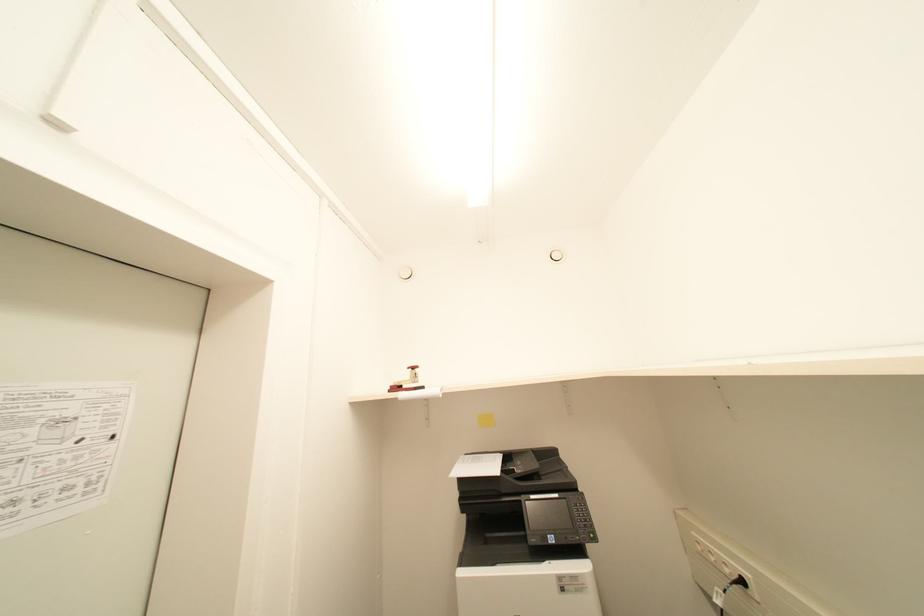
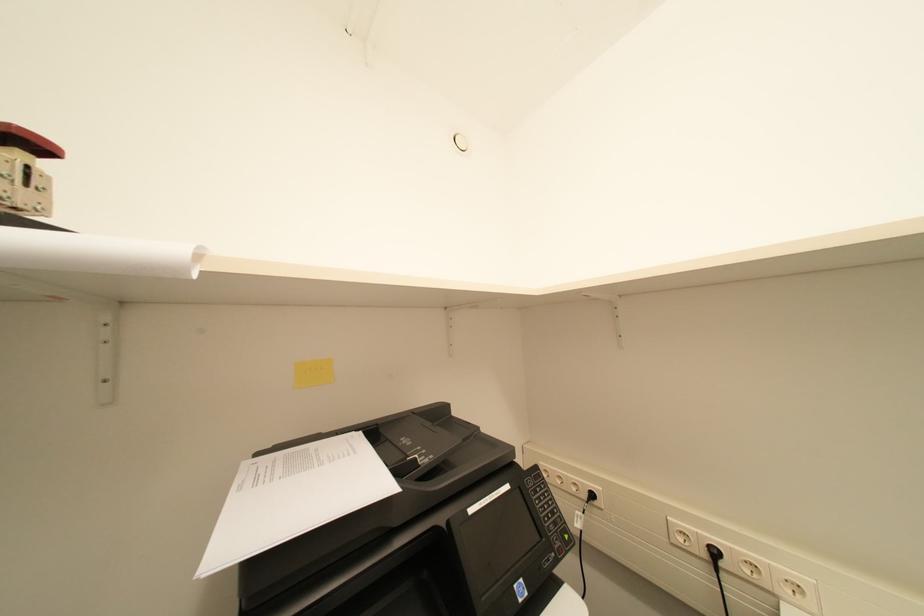
Question: The images are taken continuously from a first-person perspective. In which direction is your viewpoint rotating?

Choices:
 (A) Left
 (B) Right
 (C) Up
 (D) Down

Answer: (B)